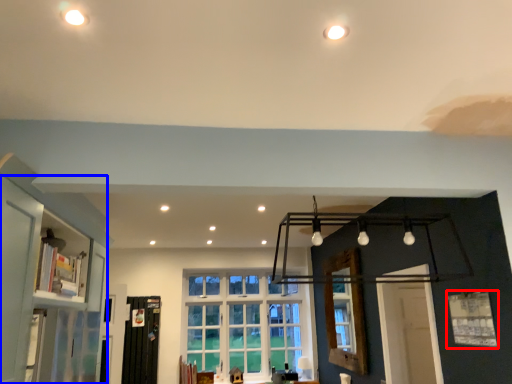
Question: Which point is further to the camera, window (highlighted by a red box) or bookshelf (highlighted by a blue box)?

Choices:
 (A) window
 (B) bookshelf

Answer: (A)